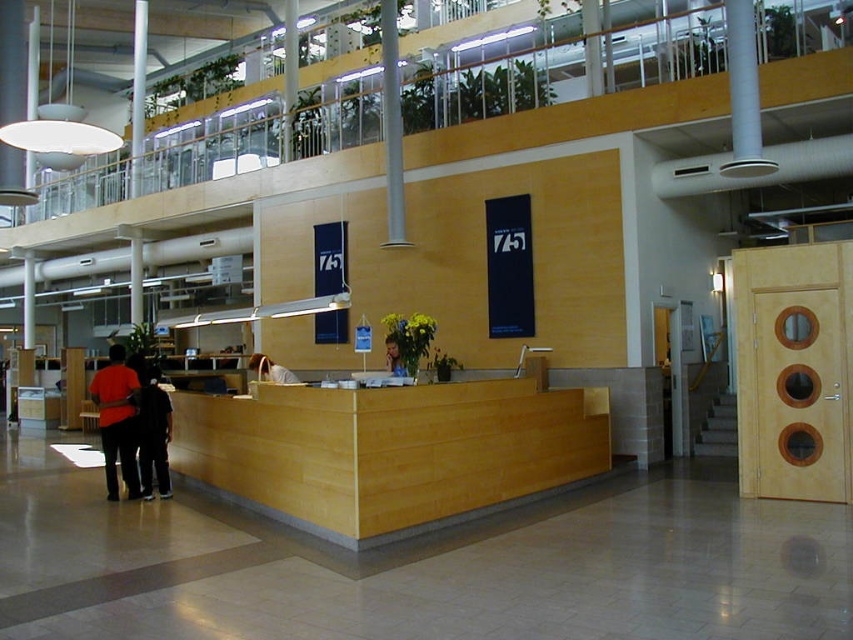
Is light wood/woodenobject at center shorter than dark clothing at lower left?

Correct, light wood/woodenobject at center is not as tall as dark clothing at lower left.

Can you confirm if light wood/woodenobject at center is positioned below dark clothing at lower left?

Yes, light wood/woodenobject at center is below dark clothing at lower left.

Does point (535, 385) come closer to viewer compared to point (163, 476)?

That is True.

Locate an element on the screen. light wood/woodenobject at center is located at coordinates (387, 451).

Which is in front, point (138, 388) or point (392, 337)?

Point (392, 337)

Who is shorter, orange shirt at lower left or smooth blue shirt at center?

smooth blue shirt at center

Who is more distant from viewer, (135, 364) or (396, 340)?

The point (135, 364) is more distant.

Identify the location of orange shirt at lower left. The width and height of the screenshot is (853, 640). (119, 417).

Is light wood/woodenobject at center shorter than light brown leather bag at center?

Incorrect, light wood/woodenobject at center's height does not fall short of light brown leather bag at center's.

Which is behind, point (399, 410) or point (282, 371)?

The point (282, 371) is more distant.

Where is `light wood/woodenobject at center`? light wood/woodenobject at center is located at coordinates (387, 451).